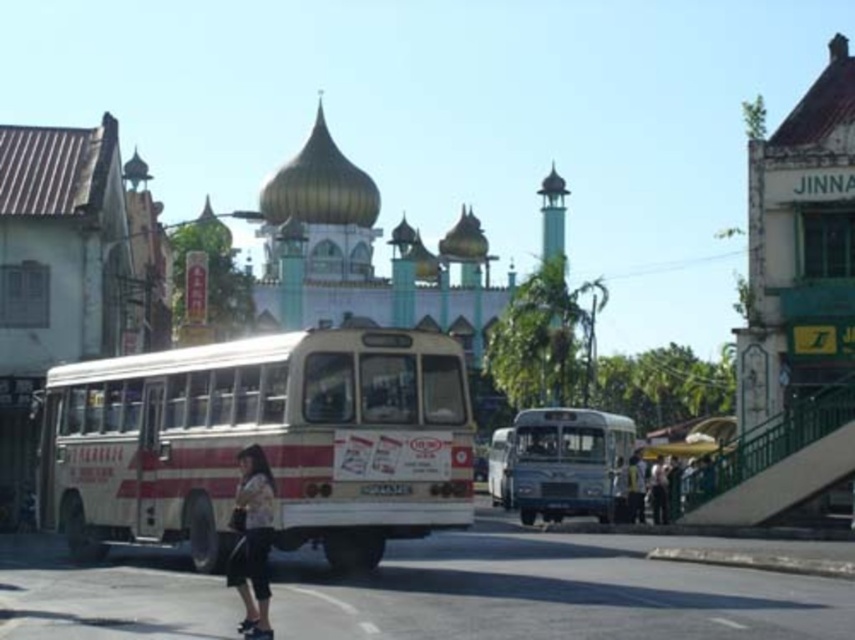
You are a pedestrian standing at the edge of the street. You see a white painted metal bus at center and a light brown leather jacket at lower right. Which object is closer to your left side?

The white painted metal bus at center is positioned on the left side of light brown leather jacket at lower right, so it is closer to your left side.

You are standing at the camera position and want to take a photo of the metallic silver bus at center. Considering the distance, would you need a zoom lens to capture the entire bus in the frame?

The metallic silver bus at center is 89.82 meters away from the camera. Depending on the focal length of your lens, you may need a zoom lens to ensure the entire bus fits within the frame at that distance.